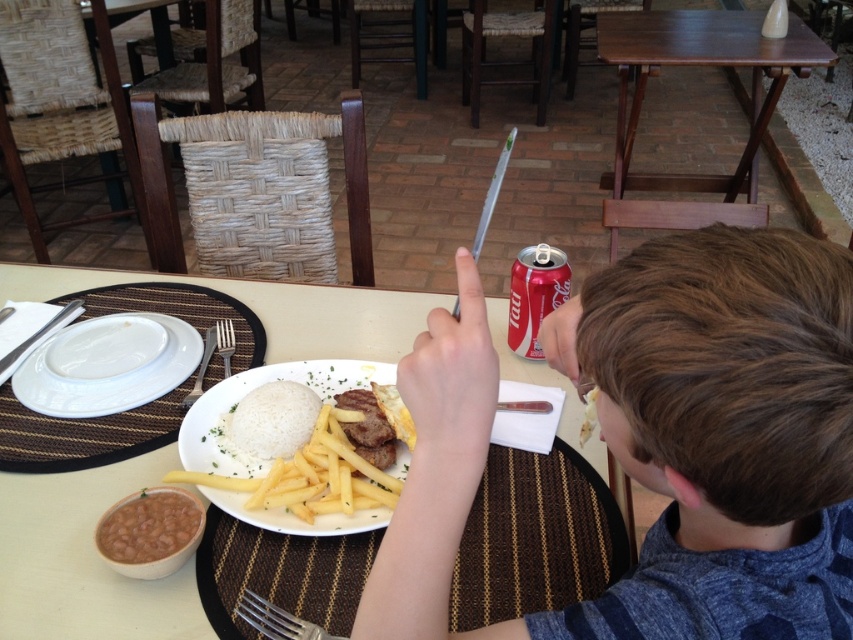
Question: Does brown hair at upper right appear under silver metallic fork at upper center?

Choices:
 (A) no
 (B) yes

Answer: (B)

Question: Which object is farther from the camera taking this photo?

Choices:
 (A) white matte rice at center
 (B) silver metallic fork at upper center
 (C) brown matte beans at lower left
 (D) white ceramic plate at center

Answer: (B)

Question: Among these objects, which one is nearest to the camera?

Choices:
 (A) yellow fried french fries at center
 (B) white matte rice at center

Answer: (A)

Question: Among these objects, which one is nearest to the camera?

Choices:
 (A) silver metallic fork at lower left
 (B) brown matte beans at lower left
 (C) white matte rice at center
 (D) silver metallic fork at lower center

Answer: (D)

Question: Is white ceramic plate at center closer to camera compared to white glossy plate at left?

Choices:
 (A) no
 (B) yes

Answer: (B)

Question: From the image, what is the correct spatial relationship of brown matte beans at lower left in relation to silver metallic fork at upper center?

Choices:
 (A) left
 (B) right

Answer: (B)